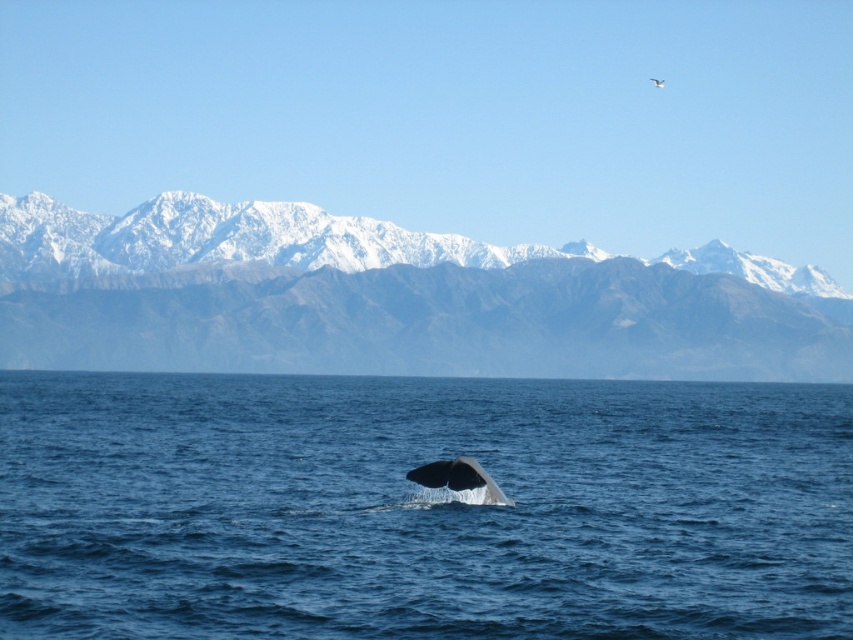
You are a sailor navigating a small boat and see the blue water at center and the snowy gray mountain range at upper center in the distance. Which object is located to the right of the other?

The blue water at center is positioned on the right side of snowy gray mountain range at upper center.

Based on the photo, you are a marine biologist observing the seascape. You notice the blue water at center and the gray smooth whale at center. Which object occupies a larger area in the image?

The blue water at center is larger in size than the gray smooth whale at center, so the blue water at center occupies a larger area in the image.

You are a marine biologist observing the ocean. You see the blue water at center and the gray smooth whale at center. How far apart are these two objects?

The distance between the blue water at center and the gray smooth whale at center is 619.81 feet.